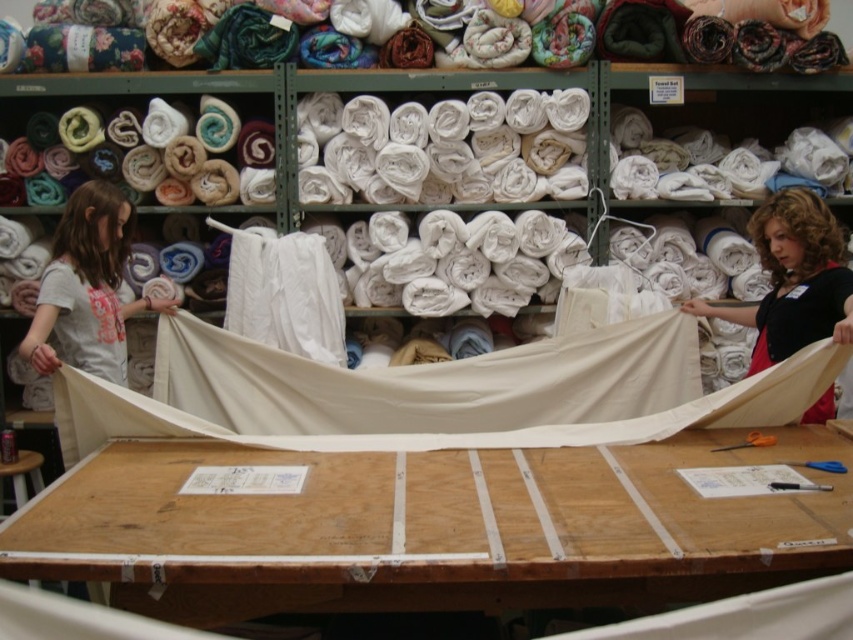
You are a customer in the fabric store. You want to ask the person in the matte black shirt at upper right a question about the wooden table at center. Which direction should you move to approach them?

The wooden table at center is to the left of the matte black shirt at upper right, so to approach the person in the matte black shirt at upper right, you should move to your right.

You are a customer in the fabric store and want to place an order. You see the wooden table at center and the matte black shirt at upper right. Which object is closer to the ceiling?

The matte black shirt at upper right is closer to the ceiling because the wooden table at center is below it.